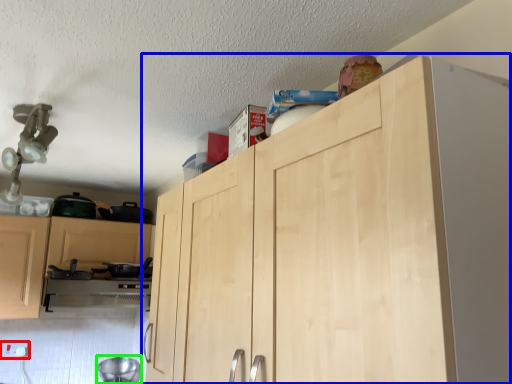
Question: Considering the real-world distances, which object is farthest from electric outlet (highlighted by a red box)? cupboard (highlighted by a blue box) or appliance (highlighted by a green box)?

Choices:
 (A) cupboard
 (B) appliance

Answer: (A)